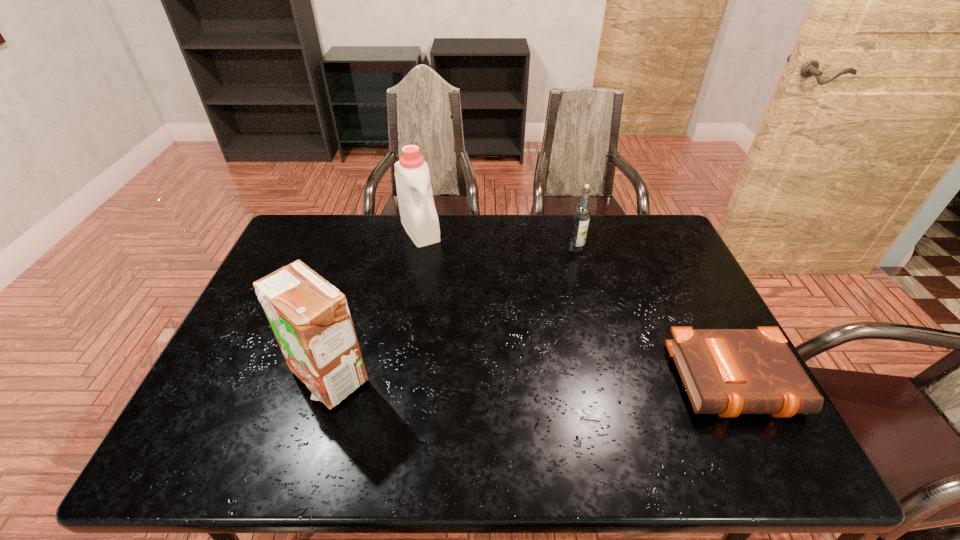
Where is `free space at the left edge of the desktop`? The image size is (960, 540). free space at the left edge of the desktop is located at coordinates (318, 267).

Identify the location of free region at the right edge of the desktop. The image size is (960, 540). (660, 261).

Image resolution: width=960 pixels, height=540 pixels. I want to click on free space at the far left corner, so click(302, 247).

I want to click on vacant area at the near left corner of the desktop, so click(252, 408).

Where is `vacant space at the far right corner of the desktop`? The image size is (960, 540). vacant space at the far right corner of the desktop is located at coordinates (620, 222).

This screenshot has width=960, height=540. What are the coordinates of `free space between the second object from right to left and the Bible` in the screenshot? It's located at (658, 315).

The height and width of the screenshot is (540, 960). I want to click on free space between the vodka and the Bible, so pyautogui.click(x=658, y=315).

Locate an element on the screen. free spot between the detergent and the shortest object is located at coordinates pyautogui.click(x=580, y=306).

Locate an element on the screen. The width and height of the screenshot is (960, 540). free point between the detergent and the third object from left to right is located at coordinates (498, 239).

I want to click on free point between the carton and the vodka, so click(x=452, y=313).